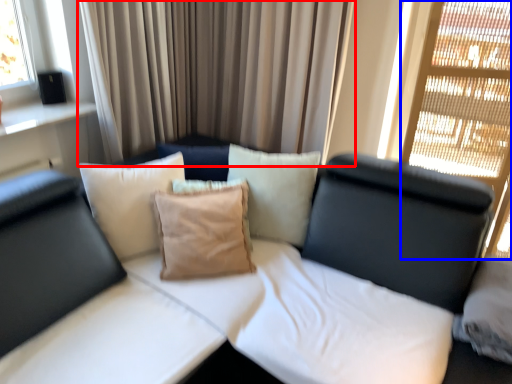
Question: Among these objects, which one is nearest to the camera, curtain (highlighted by a red box) or glass door (highlighted by a blue box)?

Choices:
 (A) curtain
 (B) glass door

Answer: (B)